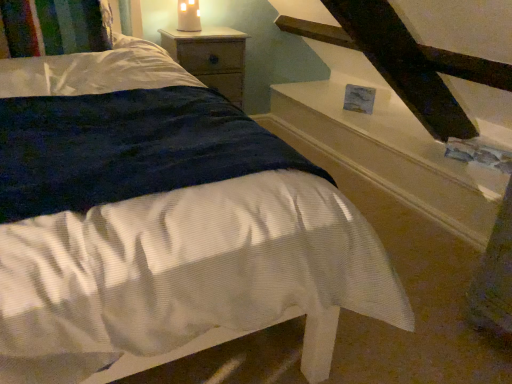
What are the coordinates of `free location to the right of matte white candle at upper center` in the screenshot? It's located at (220, 34).